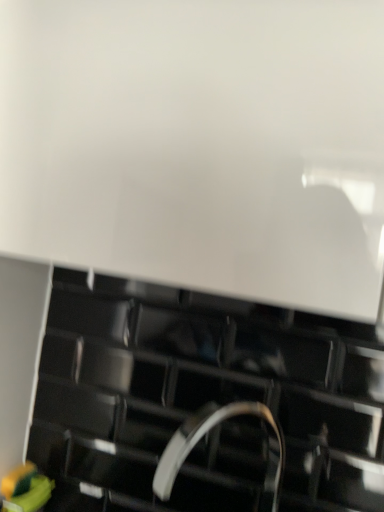
Where is `satin nickel faucet at center`? The height and width of the screenshot is (512, 384). satin nickel faucet at center is located at coordinates (205, 435).

What do you see at coordinates (205, 435) in the screenshot?
I see `satin nickel faucet at center` at bounding box center [205, 435].

This screenshot has height=512, width=384. Find the location of `satin nickel faucet at center`. satin nickel faucet at center is located at coordinates (205, 435).